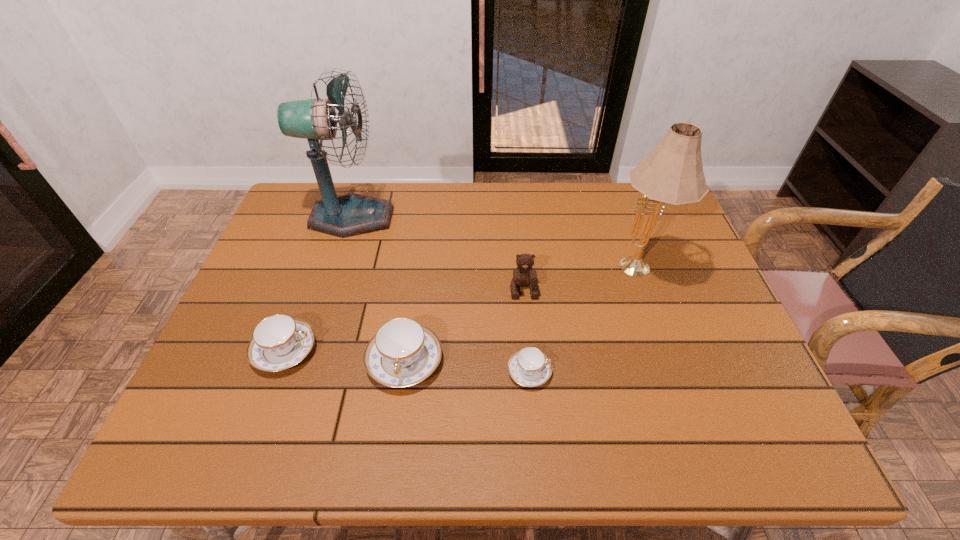
Locate an element on the screen. The image size is (960, 540). vacant space at the near edge of the desktop is located at coordinates (608, 388).

Locate an element on the screen. The height and width of the screenshot is (540, 960). vacant area at the left edge is located at coordinates (235, 328).

The width and height of the screenshot is (960, 540). I want to click on vacant region at the right edge, so click(x=666, y=315).

Locate an element on the screen. vacant space at the near left corner of the desktop is located at coordinates [x=246, y=391].

Image resolution: width=960 pixels, height=540 pixels. In order to click on vacant space that is in between the farthest object and the fourth object from right to left in this screenshot , I will do `click(378, 289)`.

Where is `blank region between the second teacup from right to left and the fan`? This screenshot has width=960, height=540. blank region between the second teacup from right to left and the fan is located at coordinates (378, 289).

Image resolution: width=960 pixels, height=540 pixels. I want to click on free space between the farthest object and the lampshade, so click(x=494, y=245).

Identify the location of free space between the shortest teacup and the teddy bear. (526, 330).

This screenshot has height=540, width=960. I want to click on vacant point located between the rightmost object and the second shortest teacup, so click(461, 310).

Locate an element on the screen. The width and height of the screenshot is (960, 540). unoccupied position between the rightmost object and the fourth object from right to left is located at coordinates (521, 316).